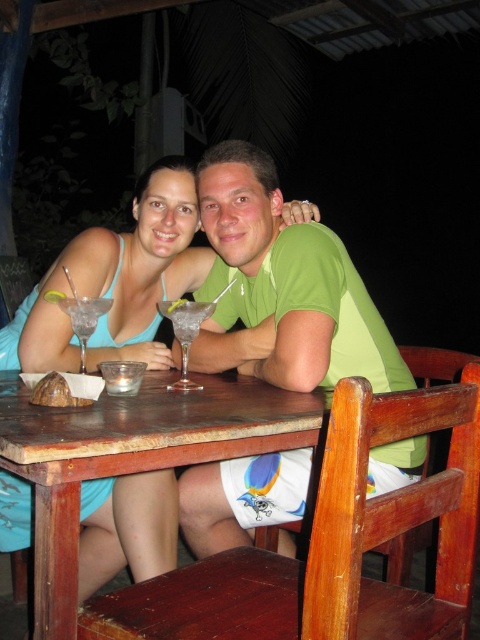
Does point (94, 426) come farther from viewer compared to point (60, 300)?

No, (94, 426) is closer to viewer.

Which is below, wooden table at center or clear glass martini at table left?

wooden table at center is below.

Between point (112, 410) and point (93, 321), which one is positioned behind?

Positioned behind is point (93, 321).

You are a GUI agent. You are given a task and a screenshot of the screen. Output one action in this format:
    pyautogui.click(x=<x>, y=<y>)
    Task: Click on the wooden table at center
    The height and width of the screenshot is (640, 480).
    Given the screenshot: What is the action you would take?
    pyautogui.click(x=132, y=456)

Between green matte shirt at center and wooden table at center, which one has more height?

green matte shirt at center

Who is positioned more to the right, green matte shirt at center or wooden table at center?

green matte shirt at center is more to the right.

Identify the location of green matte shirt at center. Image resolution: width=480 pixels, height=640 pixels. (284, 288).

Identify the location of green matte shirt at center. The height and width of the screenshot is (640, 480). (284, 288).

Who is lower down, green matte shirt at center or clear glass martini at table left?

green matte shirt at center is lower down.

I want to click on green matte shirt at center, so click(284, 288).

The width and height of the screenshot is (480, 640). What are the coordinates of `green matte shirt at center` in the screenshot? It's located at (284, 288).